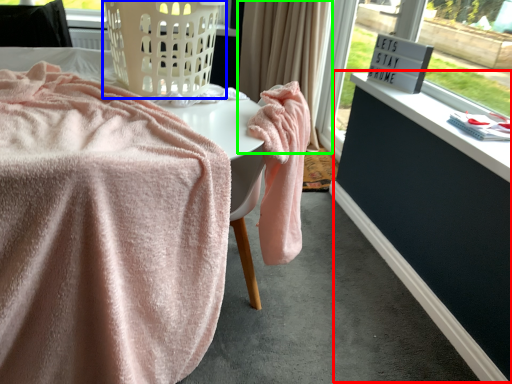
Question: Which is nearer to the dresser (highlighted by a red box)? basket (highlighted by a blue box) or curtain (highlighted by a green box).

Choices:
 (A) basket
 (B) curtain

Answer: (B)